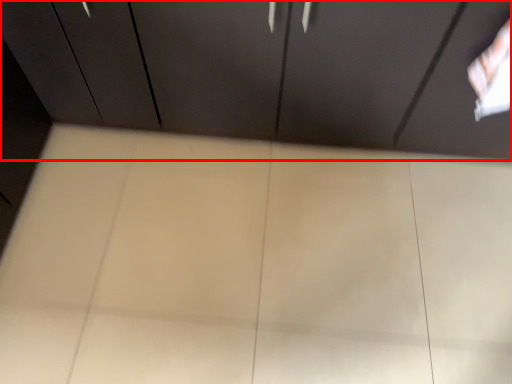
Question: Considering the relative positions of cupboard (annotated by the red box) and plywood in the image provided, where is cupboard (annotated by the red box) located with respect to the staircase?

Choices:
 (A) left
 (B) right

Answer: (B)